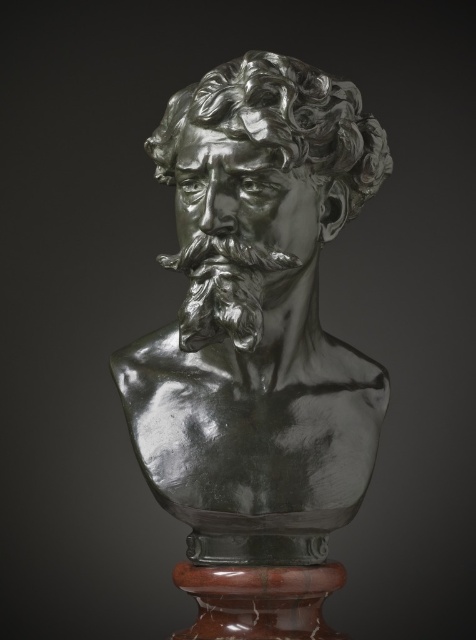
Question: Can you confirm if shiny bronze bust at center is positioned below shiny silver beard at center?

Choices:
 (A) yes
 (B) no

Answer: (A)

Question: Which point is farther from the camera taking this photo?

Choices:
 (A) (354, 109)
 (B) (204, 256)
 (C) (210, 324)

Answer: (A)

Question: Can you confirm if shiny silver bust at center is wider than shiny silver beard at center?

Choices:
 (A) no
 (B) yes

Answer: (B)

Question: Does shiny silver bust at center appear under shiny silver beard at center?

Choices:
 (A) no
 (B) yes

Answer: (A)

Question: Among these objects, which one is nearest to the camera?

Choices:
 (A) shiny silver beard at center
 (B) shiny silver bust at center
 (C) shiny bronze bust at center

Answer: (B)

Question: Which of the following is the farthest from the observer?

Choices:
 (A) shiny silver bust at center
 (B) shiny bronze bust at center
 (C) shiny silver beard at center

Answer: (C)